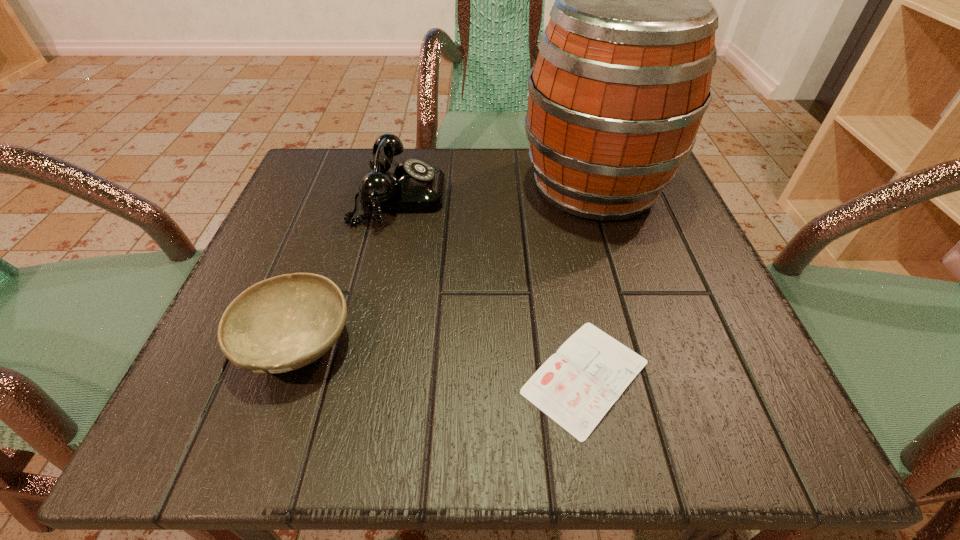
Locate an element on the screen. The height and width of the screenshot is (540, 960). cider is located at coordinates (621, 82).

Locate an element on the screen. the second tallest object is located at coordinates (412, 186).

Where is `the second shortest object`? This screenshot has width=960, height=540. the second shortest object is located at coordinates (283, 323).

What are the coordinates of `the shortest object` in the screenshot? It's located at (576, 387).

The width and height of the screenshot is (960, 540). I want to click on vacant area situated 0.240m on the left of the cider, so click(x=401, y=187).

Where is `free point located on the dial of the third shortest object`? The image size is (960, 540). free point located on the dial of the third shortest object is located at coordinates (469, 197).

Locate an element on the screen. vacant space located on the right of the second shortest object is located at coordinates (636, 342).

The width and height of the screenshot is (960, 540). Find the location of `blank space located on the left of the shortest object`. blank space located on the left of the shortest object is located at coordinates (330, 376).

This screenshot has width=960, height=540. I want to click on cider that is at the far edge, so click(621, 82).

Image resolution: width=960 pixels, height=540 pixels. I want to click on telephone located at the far edge, so click(x=412, y=186).